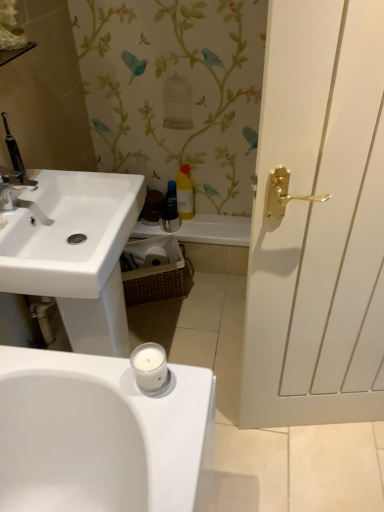
Question: From a real-world perspective, is matte silver faucet at upper left positioned under brown woven basket at center based on gravity?

Choices:
 (A) no
 (B) yes

Answer: (A)

Question: From the image's perspective, is matte silver faucet at upper left over brown woven basket at center?

Choices:
 (A) yes
 (B) no

Answer: (A)

Question: Considering the relative positions of matte silver faucet at upper left and brown woven basket at center in the image provided, is matte silver faucet at upper left in front of brown woven basket at center?

Choices:
 (A) yes
 (B) no

Answer: (A)

Question: Is matte silver faucet at upper left smaller than brown woven basket at center?

Choices:
 (A) no
 (B) yes

Answer: (B)

Question: Can you confirm if matte silver faucet at upper left is shorter than brown woven basket at center?

Choices:
 (A) yes
 (B) no

Answer: (A)

Question: Is white glossy bath at center taller or shorter than white wood door at right?

Choices:
 (A) short
 (B) tall

Answer: (A)

Question: Is white glossy bath at center spatially inside white wood door at right, or outside of it?

Choices:
 (A) outside
 (B) inside

Answer: (A)

Question: From the image's perspective, is white glossy bath at center above or below white wood door at right?

Choices:
 (A) above
 (B) below

Answer: (A)

Question: From a real-world perspective, is white glossy bath at center physically located above or below white wood door at right?

Choices:
 (A) above
 (B) below

Answer: (B)

Question: Would you say brown woven basket at center is to the left or to the right of translucent plastic bottle at center, which ranks as the 1th toiletry in left-to-right order, in the picture?

Choices:
 (A) left
 (B) right

Answer: (A)

Question: From a real-world perspective, is brown woven basket at center physically located above or below translucent plastic bottle at center, which ranks as the 1th toiletry in left-to-right order?

Choices:
 (A) below
 (B) above

Answer: (A)

Question: Choose the correct answer: Is brown woven basket at center inside translucent plastic bottle at center, which ranks as the 1th toiletry in left-to-right order, or outside it?

Choices:
 (A) outside
 (B) inside

Answer: (A)

Question: From the image's perspective, is brown woven basket at center above or below translucent plastic bottle at center, which ranks as the 1th toiletry in left-to-right order?

Choices:
 (A) below
 (B) above

Answer: (A)

Question: In the image, is translucent plastic bottle at center, the 2th toiletry in the right-to-left sequence, on the left side or the right side of matte silver faucet at upper left?

Choices:
 (A) right
 (B) left

Answer: (A)

Question: In terms of height, does translucent plastic bottle at center, which ranks as the 1th toiletry in left-to-right order, look taller or shorter compared to matte silver faucet at upper left?

Choices:
 (A) short
 (B) tall

Answer: (B)